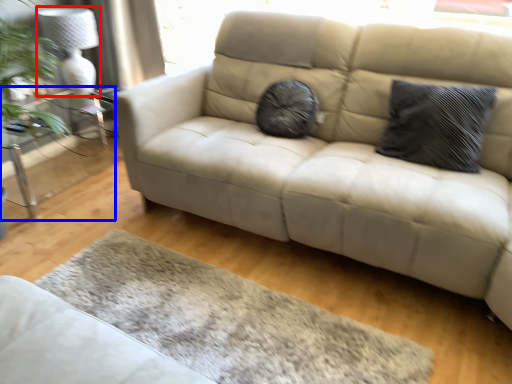
Question: Which of the following is the closest to the observer, lamp (highlighted by a red box) or table (highlighted by a blue box)?

Choices:
 (A) lamp
 (B) table

Answer: (B)